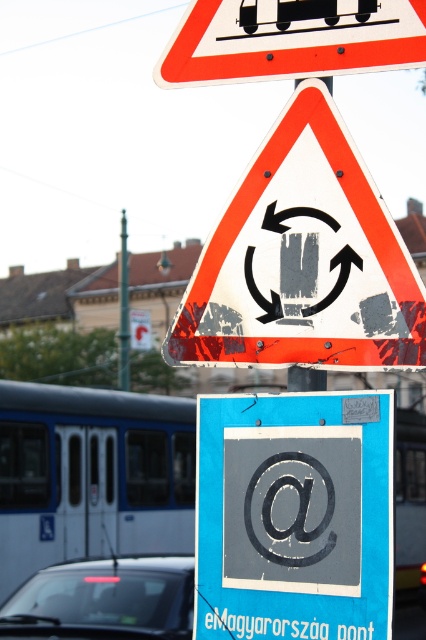
Question: Does white metallic bus at lower left appear on the right side of metallic pole at center?

Choices:
 (A) yes
 (B) no

Answer: (A)

Question: Which object is closer to the camera taking this photo?

Choices:
 (A) white plastic triangle at center
 (B) orange reflective triangle at upper center

Answer: (A)

Question: Which point is closer to the camera taking this photo?

Choices:
 (A) pos(26,564)
 (B) pos(20,608)

Answer: (B)

Question: Among these points, which one is nearest to the camera?

Choices:
 (A) (101, 586)
 (B) (324, 16)

Answer: (B)

Question: Is orange reflective triangle at upper center to the left of black glass car at lower left from the viewer's perspective?

Choices:
 (A) yes
 (B) no

Answer: (B)

Question: Can you confirm if gray matte @ symbol at center is wider than black glass car at lower left?

Choices:
 (A) yes
 (B) no

Answer: (B)